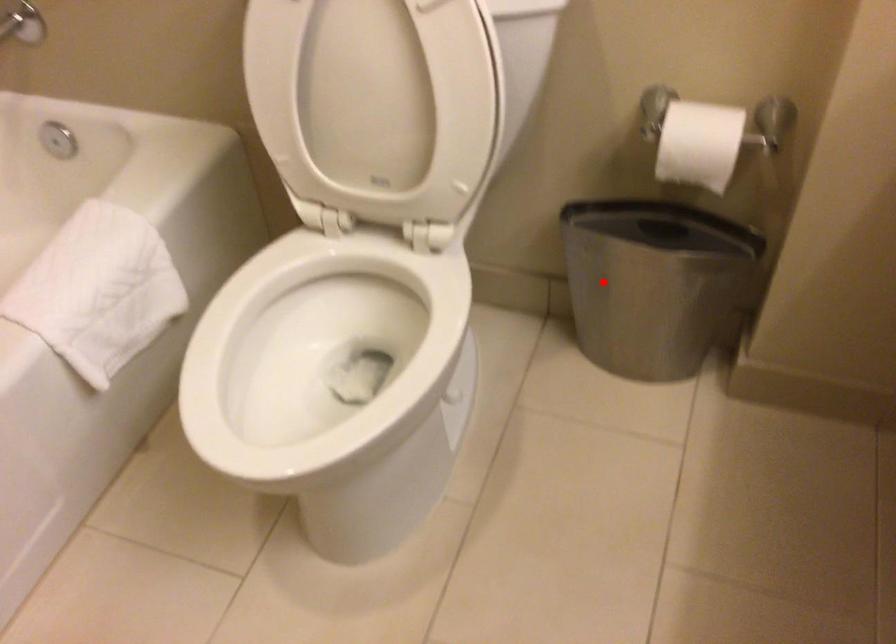
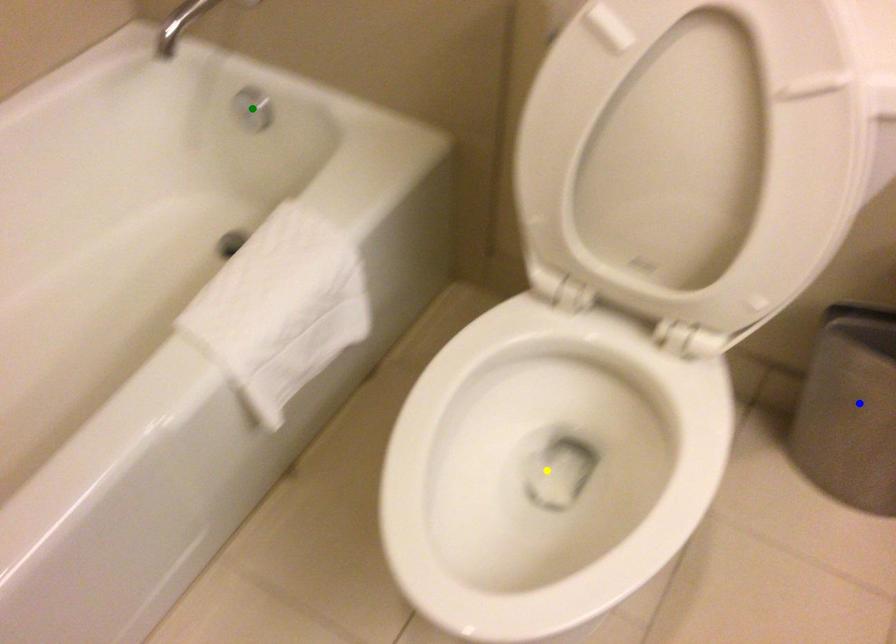
Question: I am providing you with two images of the same scene from different viewpoints. A red point is marked on the first image. You are given multiple points on the second image. Which mark in image 2 goes with the point in image 1?

Choices:
 (A) green point
 (B) blue point
 (C) yellow point

Answer: (B)